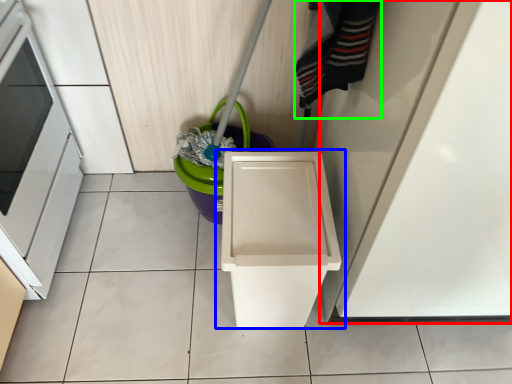
Question: Which object is positioned farthest from door (highlighted by a red box)? Select from waste container (highlighted by a blue box) and clothing (highlighted by a green box).

Choices:
 (A) waste container
 (B) clothing

Answer: (B)